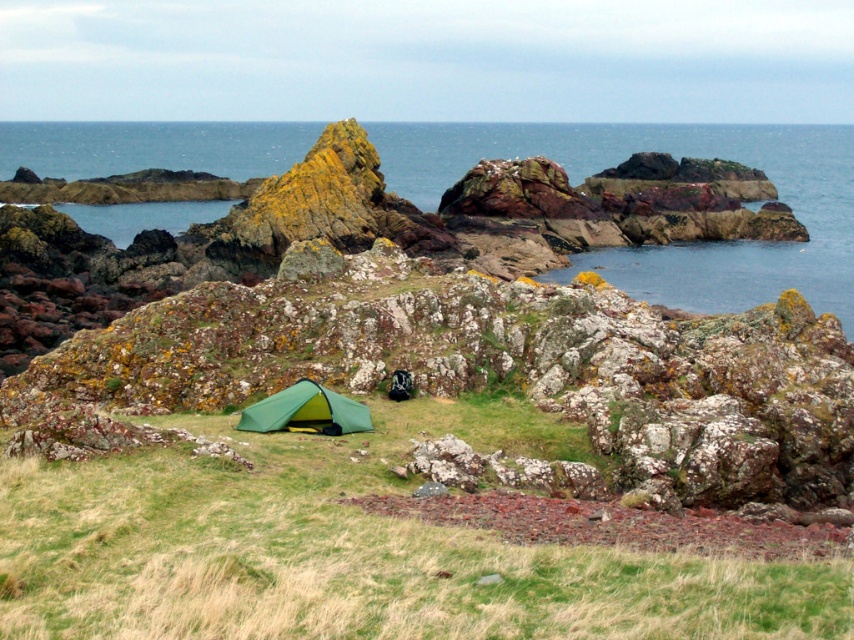
From the picture: You are standing at the green tent in the foreground of the coastal landscape. You notice two points marked in the scene. Which point, point (60, 538) or point (279, 401), is closer to you?

Point (60, 538) is closer to you than point (279, 401) because it is positioned closer to the camera in the scene.

You are a hiker who just arrived at the campsite. You need to set up your gear. Which object is closer to you, the green grassy at center or the green fabric tent at center?

The green grassy at center is closer to the viewer than the green fabric tent at center.